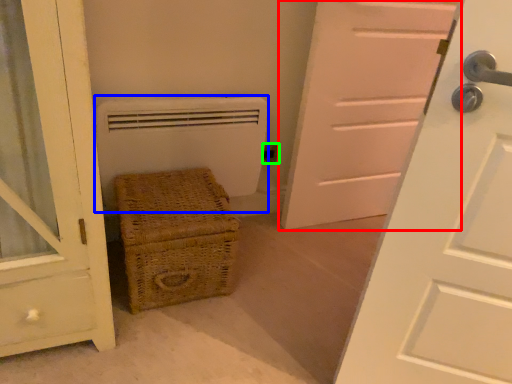
Question: Based on their relative distances, which object is nearer to door (highlighted by a red box)? Choose from heater (highlighted by a blue box) and electric outlet (highlighted by a green box).

Choices:
 (A) heater
 (B) electric outlet

Answer: (B)